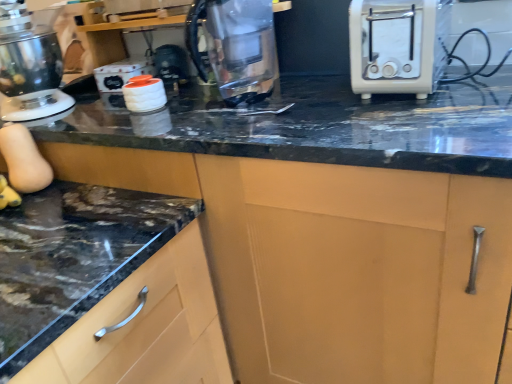
At what (x,y) coordinates should I click in order to perform the action: click on vacant space behind transparent glass kettle at center. Please return your answer as a coordinate pair (x, y). Looking at the image, I should click on (237, 85).